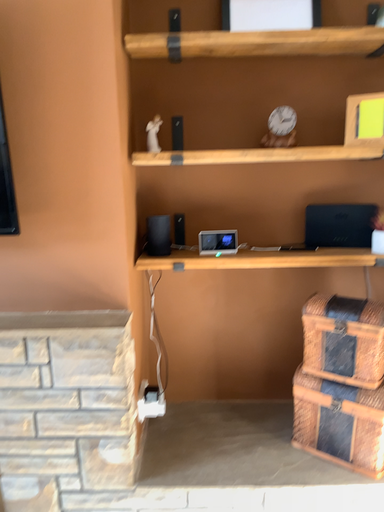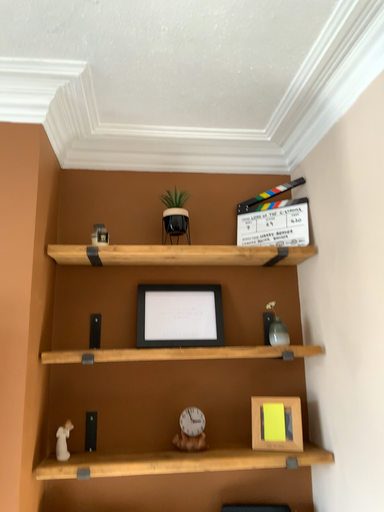
Question: Which way did the camera rotate in the video?

Choices:
 (A) rotated left
 (B) rotated right

Answer: (B)